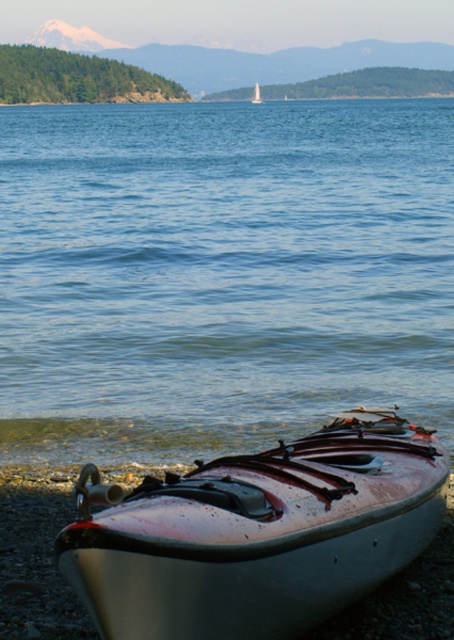
You are standing on the lakeshore and want to reach the blue water at lower center. The silver metallic kayak at lower center is in your way. Can you walk around the kayak to get to the water?

The distance between the blue water at lower center and the silver metallic kayak at lower center is 18.96 meters, so there is enough space to walk around the kayak and reach the water.

You are standing on the lakeside and see the blue water at lower center and the silver metallic kayak at lower center. Which one is positioned higher from the ground level?

The blue water at lower center is located above the silver metallic kayak at lower center, so the blue water at lower center is higher from the ground level.

You are planning to store both the silver metallic kayak at lower center and the white glossy kayak at lower center in a storage unit. Based on the scene, which kayak will require less space in the storage unit?

The silver metallic kayak at lower center occupies less space than the white glossy kayak at lower center, so it will require less space in the storage unit.